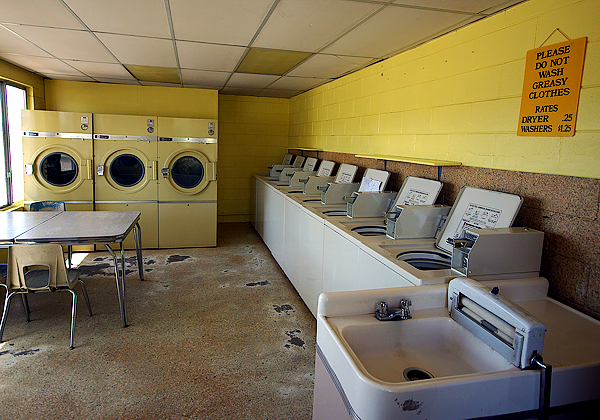
The image size is (600, 420). In order to click on table in this screenshot , I will do `click(101, 230)`.